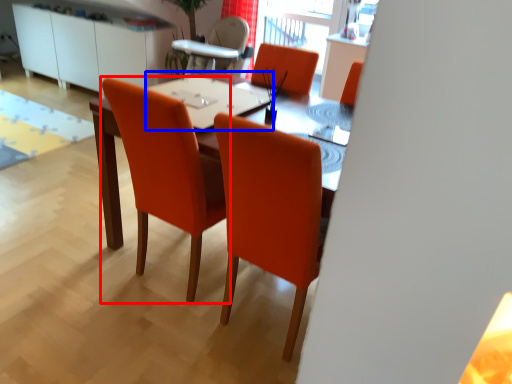
Question: Which object is closer to the camera taking this photo, chair (highlighted by a red box) or table top (highlighted by a blue box)?

Choices:
 (A) chair
 (B) table top

Answer: (A)